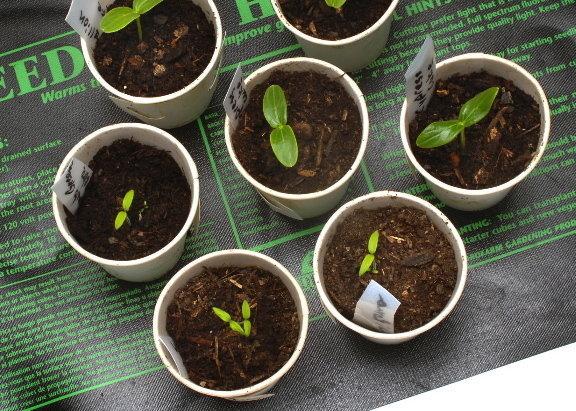
The width and height of the screenshot is (576, 411). I want to click on 7 white styrofoam cups, so click(305, 318), click(333, 311), click(445, 188), click(340, 182), click(195, 207), click(183, 91), click(366, 37).